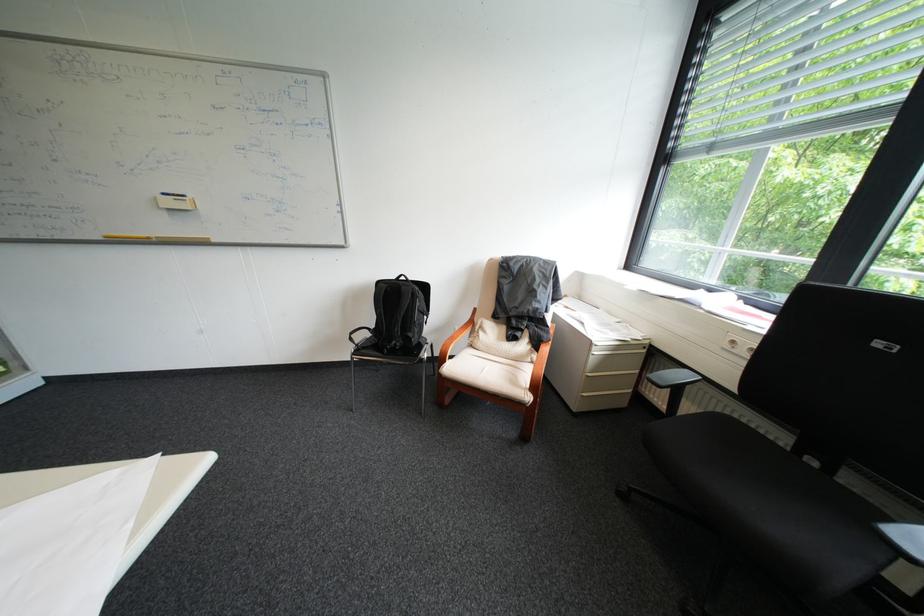
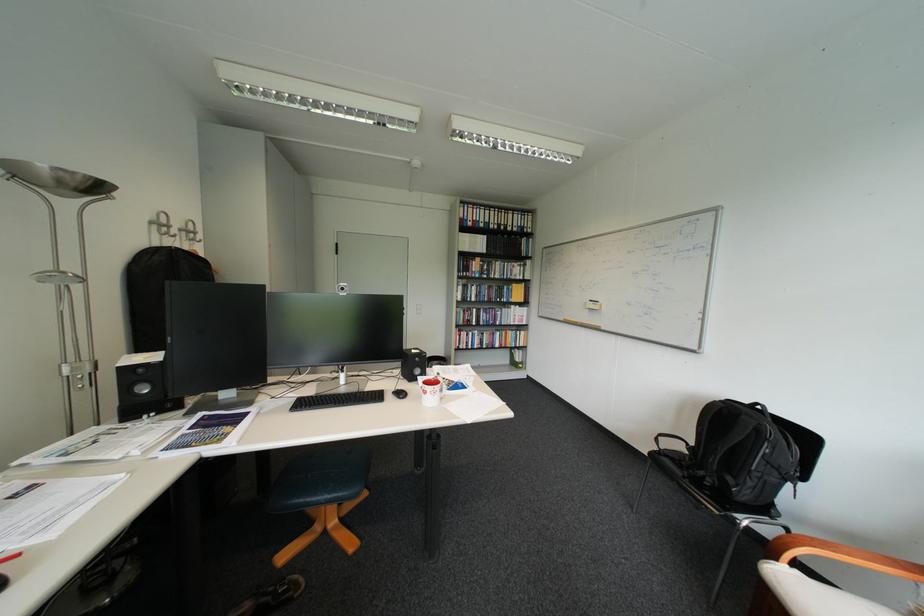
In the second image, find the point that corresponds to (167,199) in the first image.

(598, 304)